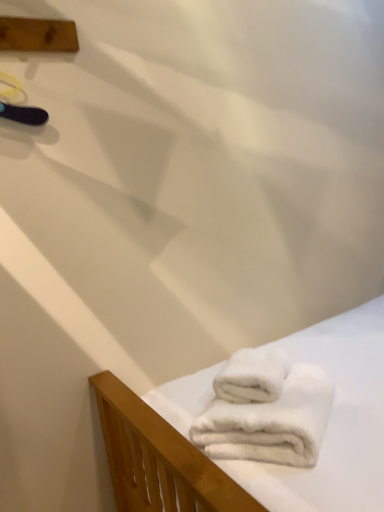
Question: Should I look upward or downward to see white fluffy towels at lower right, which ranks as the first towel in bottom-to-top order?

Choices:
 (A) down
 (B) up

Answer: (A)

Question: Does wooden plank at upper left appear on the left side of white fluffy towel at lower right, acting as the second towel starting from the bottom?

Choices:
 (A) yes
 (B) no

Answer: (A)

Question: Is wooden plank at upper left touching white fluffy towel at lower right, which is the 1th towel from top to bottom?

Choices:
 (A) yes
 (B) no

Answer: (B)

Question: Is wooden plank at upper left shorter than white fluffy towel at lower right, which is the 1th towel from top to bottom?

Choices:
 (A) yes
 (B) no

Answer: (B)

Question: From a real-world perspective, is wooden plank at upper left physically above white fluffy towel at lower right, acting as the second towel starting from the bottom?

Choices:
 (A) yes
 (B) no

Answer: (A)

Question: Does wooden plank at upper left contain white fluffy towel at lower right, acting as the second towel starting from the bottom?

Choices:
 (A) yes
 (B) no

Answer: (B)

Question: Does wooden plank at upper left turn towards white fluffy towel at lower right, which is the 1th towel from top to bottom?

Choices:
 (A) yes
 (B) no

Answer: (B)

Question: From a real-world perspective, is white fluffy towel at lower right, acting as the second towel starting from the bottom, positioned under wooden plank at upper left based on gravity?

Choices:
 (A) no
 (B) yes

Answer: (B)

Question: Does white fluffy towel at lower right, acting as the second towel starting from the bottom, have a lesser width compared to wooden plank at upper left?

Choices:
 (A) no
 (B) yes

Answer: (A)

Question: Can you confirm if white fluffy towel at lower right, which is the 1th towel from top to bottom, is bigger than wooden plank at upper left?

Choices:
 (A) yes
 (B) no

Answer: (A)

Question: Is white fluffy towel at lower right, which is the 1th towel from top to bottom, far away from wooden plank at upper left?

Choices:
 (A) yes
 (B) no

Answer: (A)

Question: Considering the relative positions of white fluffy towel at lower right, which is the 1th towel from top to bottom, and wooden plank at upper left in the image provided, is white fluffy towel at lower right, which is the 1th towel from top to bottom, behind wooden plank at upper left?

Choices:
 (A) yes
 (B) no

Answer: (B)

Question: Considering the relative sizes of white fluffy towel at lower right, which is the 1th towel from top to bottom, and wooden plank at upper left in the image provided, is white fluffy towel at lower right, which is the 1th towel from top to bottom, wider than wooden plank at upper left?

Choices:
 (A) yes
 (B) no

Answer: (A)

Question: From the image's perspective, is white fluffy towels at lower right, which ranks as the first towel in bottom-to-top order, beneath wooden plank at upper left?

Choices:
 (A) yes
 (B) no

Answer: (A)